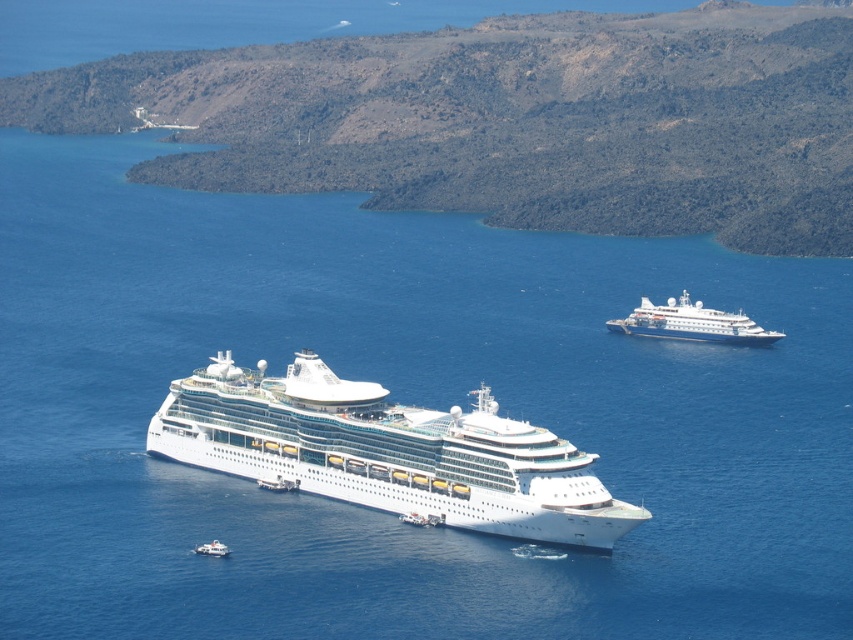
You are a passenger on the white glossy cruise ship at center and want to take a photo of the white glossy cruise ship at upper right. Which direction should you move to get a better view of it?

The white glossy cruise ship at center is positioned on the left side of the white glossy cruise ship at upper right. To get a better view, you should move to the right side of the ship to align with the white glossy cruise ship at upper right.

You are a passenger on the white glossy cruise ship at upper right and want to see the white glossy boat at lower left. Based on the scene, where should you look relative to your current position?

The white glossy cruise ship at upper right is located above the white glossy boat at lower left, so you should look downward from your current position to see the white glossy boat at lower left.